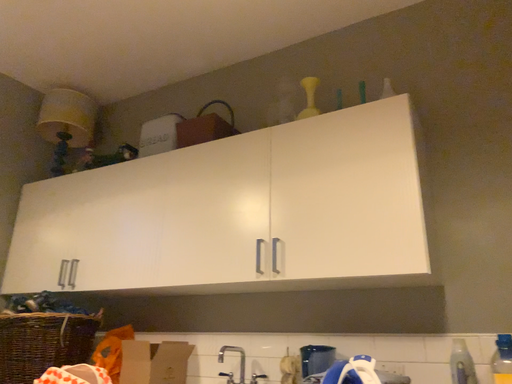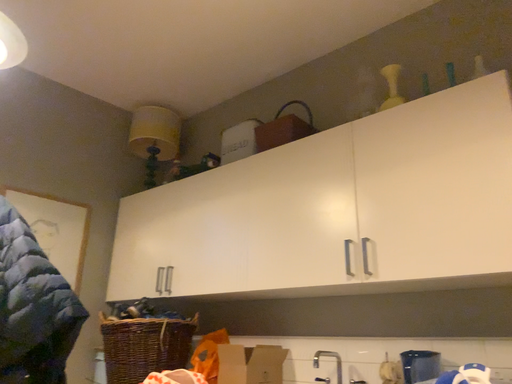
Question: How did the camera likely rotate when shooting the video?

Choices:
 (A) rotated right
 (B) rotated left

Answer: (B)